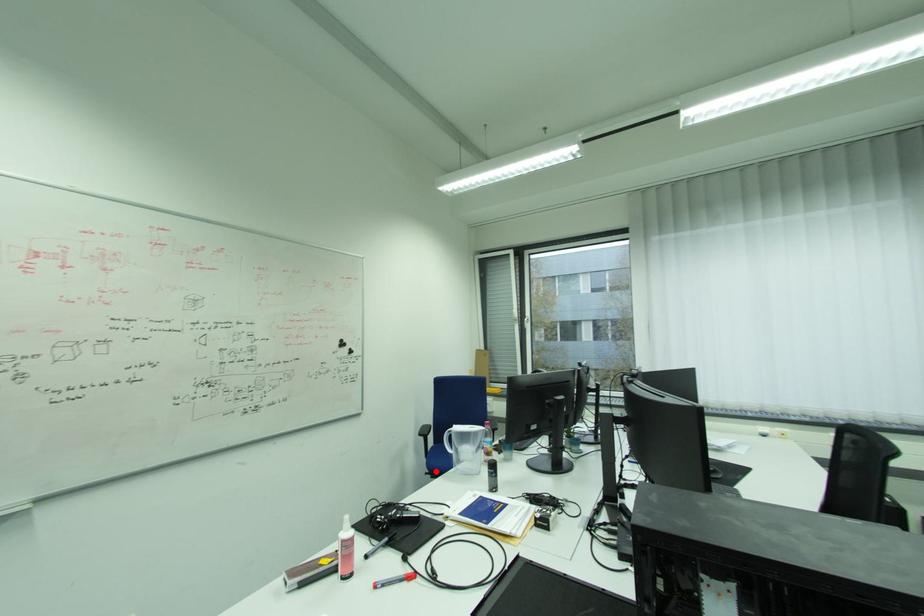
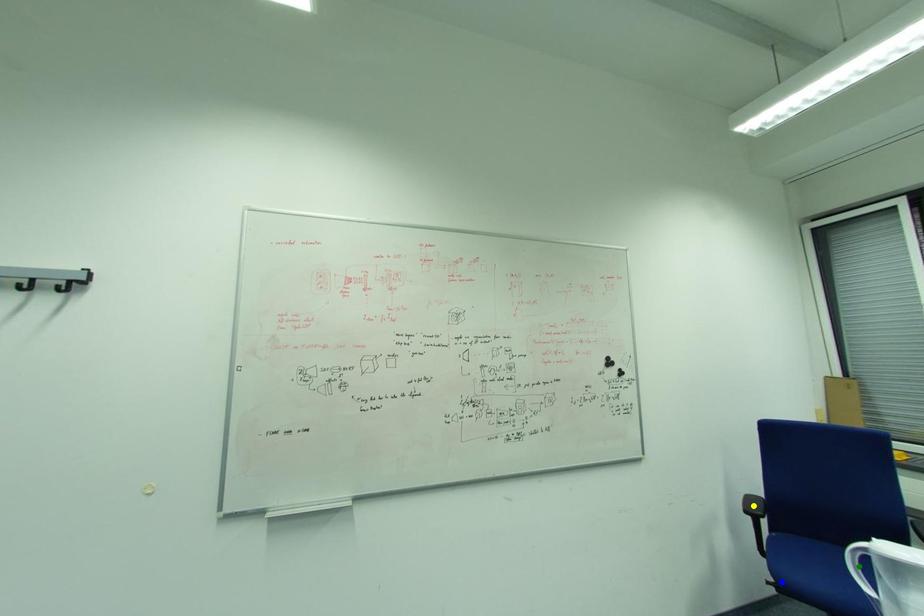
Question: I am providing you with two images of the same scene from different viewpoints. A red point is marked on the first image. You are given multiple points on the second image. Which point in image 2 is actually the same real-world point as the red point in image 1?

Choices:
 (A) yellow point
 (B) green point
 (C) blue point

Answer: (C)